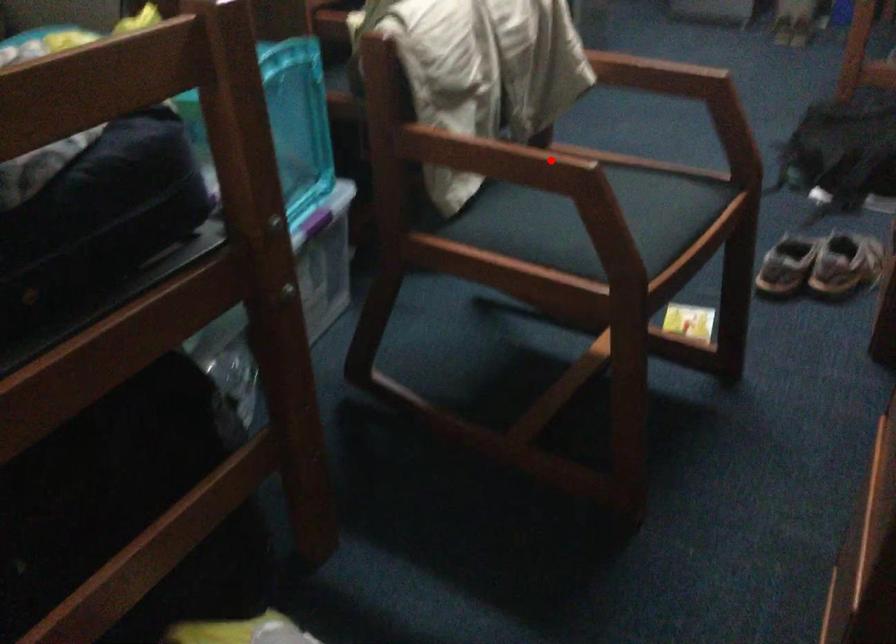
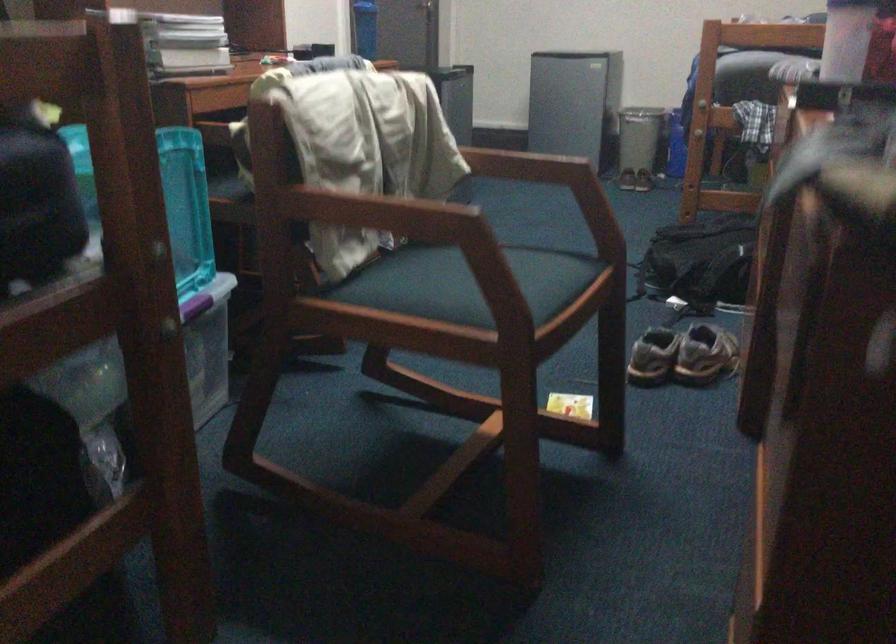
In the second image, find the point that corresponds to the highlighted location in the first image.

(436, 210)